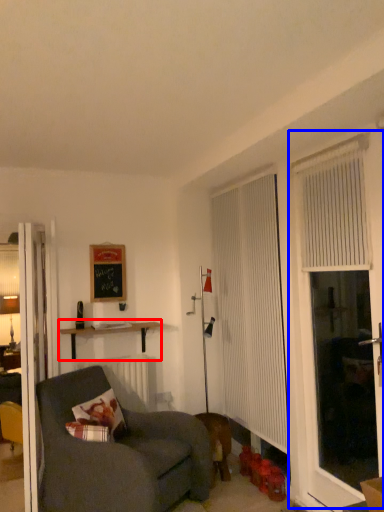
Question: Among these objects, which one is nearest to the camera, shelf (highlighted by a red box) or screen door (highlighted by a blue box)?

Choices:
 (A) shelf
 (B) screen door

Answer: (B)